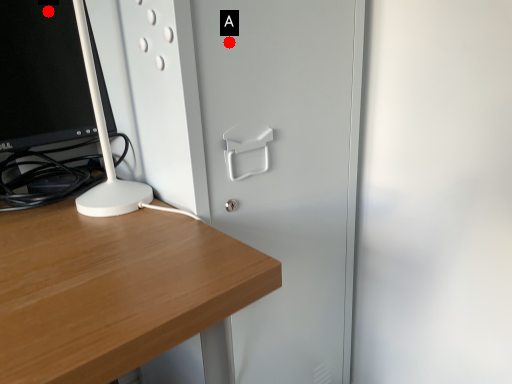
Question: Two points are circled on the image, labeled by A and B beside each circle. Which of the following is the closest to the observer?

Choices:
 (A) A is closer
 (B) B is closer

Answer: (A)